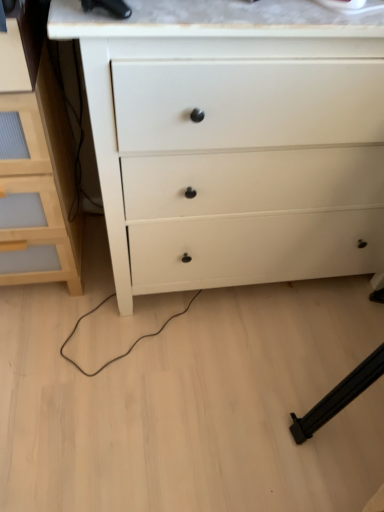
I want to click on vacant area that is situated to the right of light wood chest of drawers at left, which is the 2th chest of drawers from right to left, so click(131, 300).